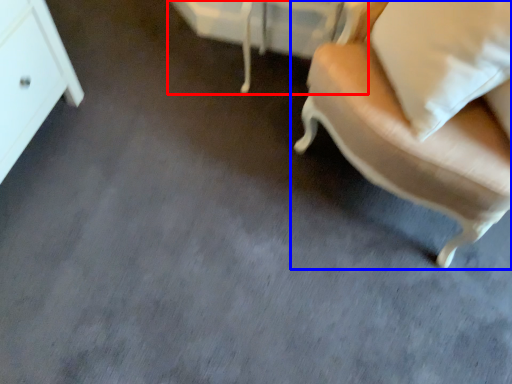
Question: Which object is further to the camera taking this photo, vanity (highlighted by a red box) or chair (highlighted by a blue box)?

Choices:
 (A) vanity
 (B) chair

Answer: (A)